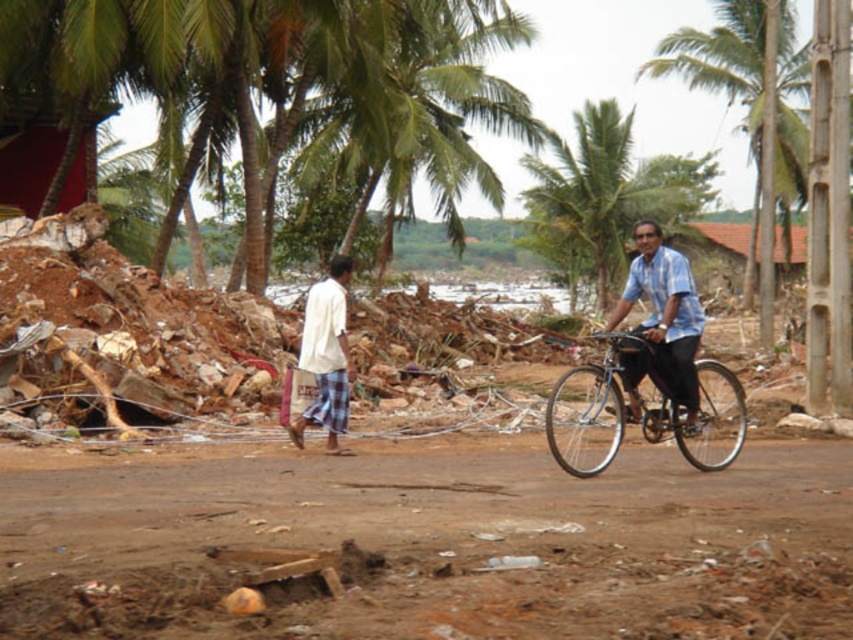
Measure the distance between brown dirt field at center and blue shirt at center.

brown dirt field at center is 3.30 meters from blue shirt at center.

Is brown dirt field at center to the left of blue shirt at center from the viewer's perspective?

In fact, brown dirt field at center is to the right of blue shirt at center.

What do you see at coordinates (432, 545) in the screenshot?
I see `brown dirt field at center` at bounding box center [432, 545].

Image resolution: width=853 pixels, height=640 pixels. I want to click on brown dirt field at center, so click(432, 545).

Which is above, green leafy palm tree at upper right or blue shirt at center?

green leafy palm tree at upper right is above.

From the picture: Who is more distant from viewer, (x=762, y=332) or (x=653, y=301)?

The point (x=762, y=332) is behind.

You are a GUI agent. You are given a task and a screenshot of the screen. Output one action in this format:
    pyautogui.click(x=<x>, y=<y>)
    Task: Click on the green leafy palm tree at upper right
    The width and height of the screenshot is (853, 640).
    Given the screenshot: What is the action you would take?
    pyautogui.click(x=753, y=113)

Is metallic blue bicycle at right thinner than blue shirt at center?

Incorrect, metallic blue bicycle at right's width is not less than blue shirt at center's.

Does metallic blue bicycle at right lie behind blue shirt at center?

No, metallic blue bicycle at right is in front of blue shirt at center.

Is point (618, 392) closer to viewer compared to point (662, 360)?

That is True.

This screenshot has width=853, height=640. I want to click on metallic blue bicycle at right, so click(x=590, y=408).